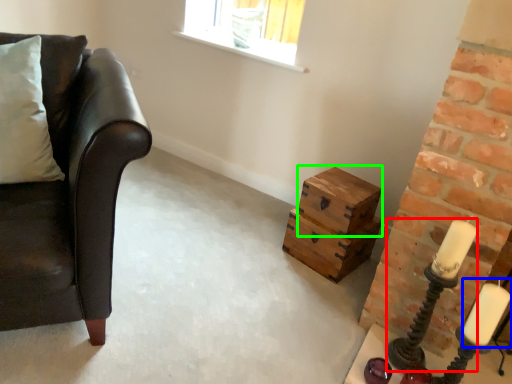
Question: Based on their relative distances, which object is nearer to candle holder (highlighted by a red box)? Choose from candle (highlighted by a blue box) and box (highlighted by a green box).

Choices:
 (A) candle
 (B) box

Answer: (A)